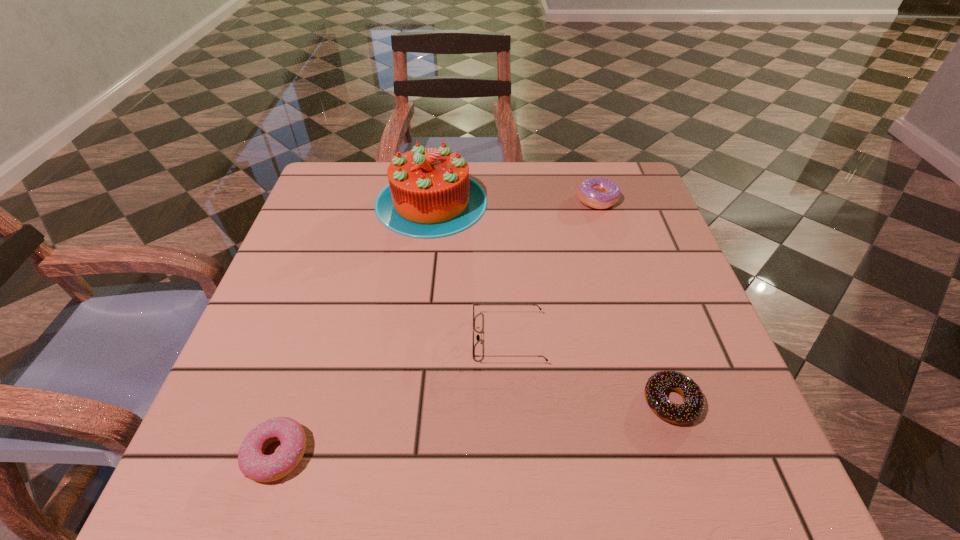
I want to click on the tallest object, so click(430, 195).

Locate an element on the screen. the farthest doughnut is located at coordinates (600, 193).

Locate an element on the screen. The image size is (960, 540). the third farthest object is located at coordinates (477, 337).

Locate an element on the screen. the leftmost doughnut is located at coordinates (254, 464).

Identify the location of the shortest object. The image size is (960, 540). 691,409.

Locate an element on the screen. This screenshot has width=960, height=540. vacant space situated on the front of the tallest object is located at coordinates (424, 256).

Where is `vacant space situated 0.100m on the front of the farthest doughnut`? The height and width of the screenshot is (540, 960). vacant space situated 0.100m on the front of the farthest doughnut is located at coordinates [x=610, y=239].

I want to click on vacant space located on the front-facing side of the sunglasses, so click(x=408, y=339).

Locate an element on the screen. The image size is (960, 540). vacant space situated 0.120m on the front-facing side of the sunglasses is located at coordinates coord(408,339).

I want to click on vacant region located on the front-facing side of the sunglasses, so click(262, 339).